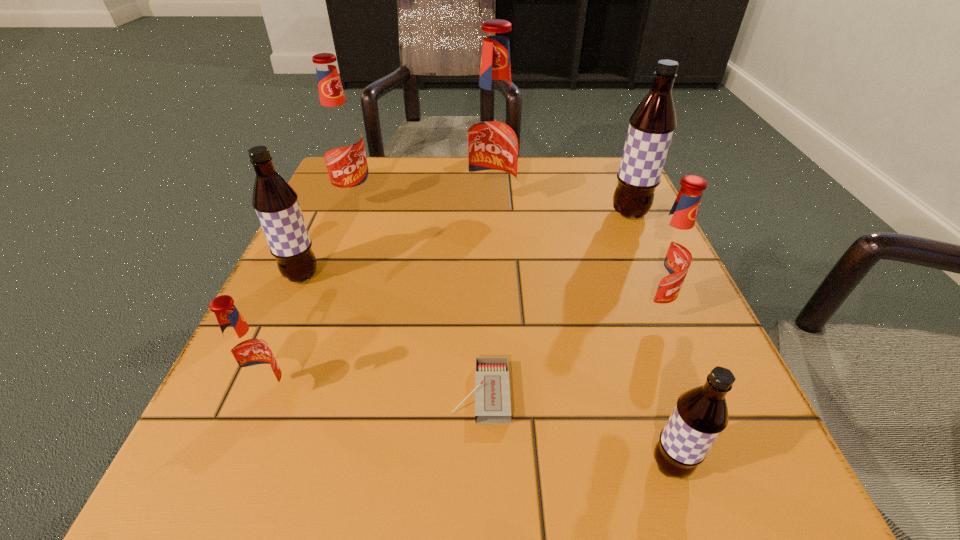
Point out which red root beer is positioned as the third nearest to the rightmost brown root beer. Please provide its 2D coordinates. Your answer should be formatted as a tuple, i.e. [(x, y)], where the tuple contains the x and y coordinates of a point satisfying the conditions above.

[(341, 140)]

Locate which red root beer ranks fourth in proximity to the nearest object. Please provide its 2D coordinates. Your answer should be formatted as a tuple, i.e. [(x, y)], where the tuple contains the x and y coordinates of a point satisfying the conditions above.

[(341, 140)]

Select which brown root beer is the closest to the nearest red root beer. Please provide its 2D coordinates. Your answer should be formatted as a tuple, i.e. [(x, y)], where the tuple contains the x and y coordinates of a point satisfying the conditions above.

[(276, 203)]

You are a GUI agent. You are given a task and a screenshot of the screen. Output one action in this format:
    pyautogui.click(x=<x>, y=<y>)
    Task: Click on the brown root beer that is the closest to the farthest brown root beer
    The image size is (960, 540).
    Given the screenshot: What is the action you would take?
    pyautogui.click(x=701, y=414)

Image resolution: width=960 pixels, height=540 pixels. In order to click on free space that satisfies the following two spatial constraints: 1. on the back side of the nearest red root beer; 2. on the right side of the rightmost brown root beer in this screenshot , I will do click(344, 213).